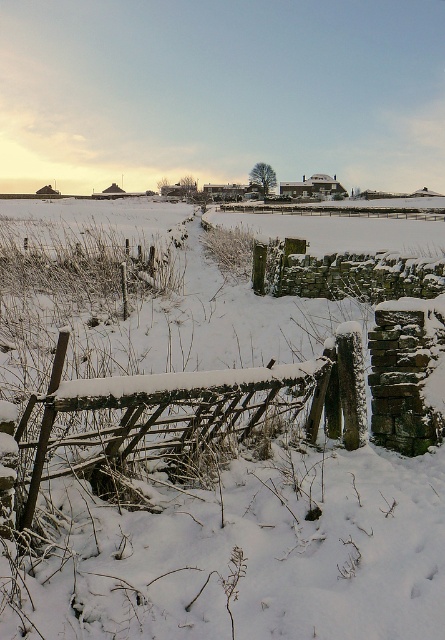
Question: Estimate the real-world distances between objects in this image. Which object is closer to the woven wood fence at center?

Choices:
 (A) wooden wicker fence at center
 (B) white frosty fence at center

Answer: (B)

Question: Estimate the real-world distances between objects in this image. Which object is farther from the white frosty fence at center?

Choices:
 (A) woven wood fence at center
 (B) wooden wicker fence at center

Answer: (A)

Question: Which of these objects is positioned farthest from the white frosty fence at center?

Choices:
 (A) wooden wicker fence at center
 (B) woven wood fence at center

Answer: (B)

Question: Is white frosty fence at center above woven wood fence at center?

Choices:
 (A) yes
 (B) no

Answer: (B)

Question: Where is wooden wicker fence at center located in relation to woven wood fence at center in the image?

Choices:
 (A) right
 (B) left

Answer: (B)

Question: Where is white frosty fence at center located in relation to wooden wicker fence at center in the image?

Choices:
 (A) above
 (B) below

Answer: (A)